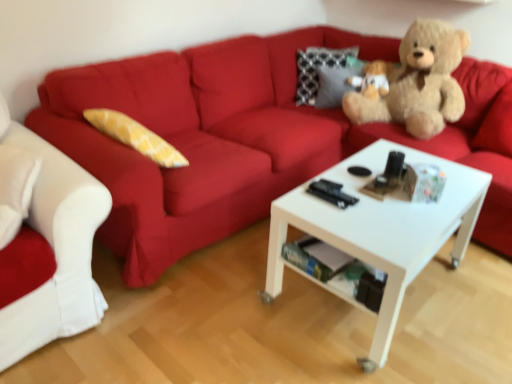
Question: Choose the correct answer: Is soft brown teddy bear at upper right inside white fabric couch at left, which is the first studio couch from left to right, or outside it?

Choices:
 (A) inside
 (B) outside

Answer: (B)

Question: From the image's perspective, relative to white fabric couch at left, which is the first studio couch from left to right, is soft brown teddy bear at upper right above or below?

Choices:
 (A) below
 (B) above

Answer: (B)

Question: Considering the real-world distances, which object is closest to the white fabric couch at left, which is the second studio couch in right-to-left order?

Choices:
 (A) soft brown teddy bear at upper right
 (B) matte red couch at upper center, marked as the first studio couch in a right-to-left arrangement
 (C) white matte coffee table at center

Answer: (B)

Question: Which object is the farthest from the white matte coffee table at center?

Choices:
 (A) white fabric couch at left, which is the second studio couch in right-to-left order
 (B) matte red couch at upper center, arranged as the 2th studio couch when viewed from the left
 (C) soft brown teddy bear at upper right

Answer: (A)